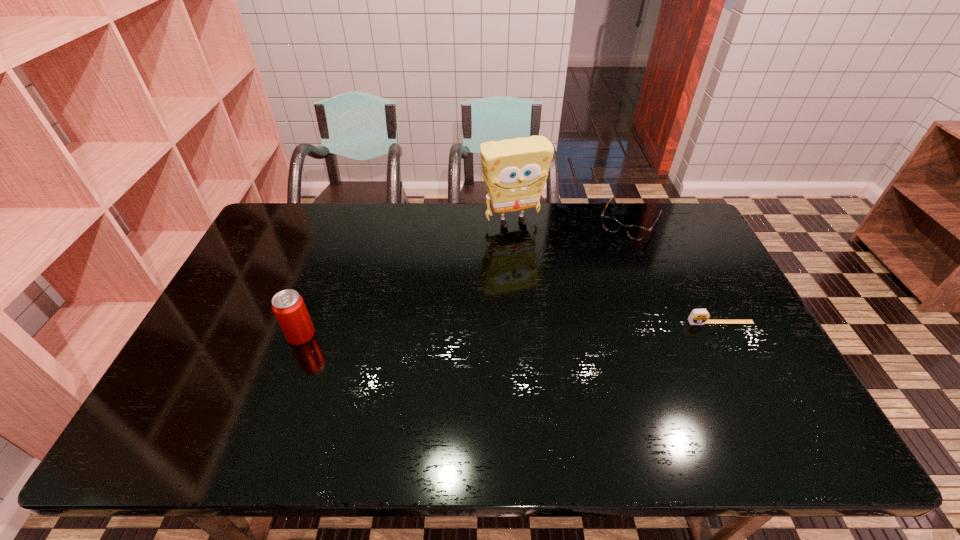
At what (x,y) coordinates should I click in order to perform the action: click on free space on the desktop that is between the second tallest object and the shortest object and is positioned on the face of the sponge. Please return your answer as a coordinate pair (x, y). The width and height of the screenshot is (960, 540). Looking at the image, I should click on (568, 327).

The width and height of the screenshot is (960, 540). I want to click on vacant space on the desktop that is between the leftmost object and the tape measure and is positioned on the front-facing side of the second shortest object, so (570, 327).